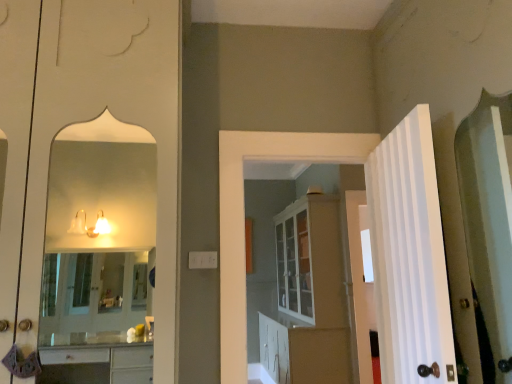
Question: Is white glossy cabinet at center not close to white striped door at right, which appears as the 2th door when viewed from the right?

Choices:
 (A) no
 (B) yes

Answer: (B)

Question: Does white glossy cabinet at center come behind white striped door at right, which appears as the 2th door when viewed from the right?

Choices:
 (A) yes
 (B) no

Answer: (A)

Question: Considering the relative sizes of white glossy cabinet at center and white striped door at right, which appears as the first door when viewed from the front, in the image provided, is white glossy cabinet at center smaller than white striped door at right, which appears as the first door when viewed from the front,?

Choices:
 (A) yes
 (B) no

Answer: (B)

Question: From a real-world perspective, is white glossy cabinet at center physically above white striped door at right, which appears as the first door when viewed from the front?

Choices:
 (A) no
 (B) yes

Answer: (A)

Question: Is white glossy cabinet at center in front of white striped door at right, which ranks as the third door in back-to-front order?

Choices:
 (A) yes
 (B) no

Answer: (B)

Question: Visually, is white glossy cabinet at center, positioned as the first door in left-to-right order, positioned to the left or to the right of white glossy door at right, which is the 1th door in back-to-front order?

Choices:
 (A) right
 (B) left

Answer: (B)

Question: Is point (237, 200) positioned closer to the camera than point (346, 205)?

Choices:
 (A) closer
 (B) farther

Answer: (A)

Question: Is white glossy cabinet at center, positioned as the first door in left-to-right order, bigger or smaller than white glossy door at right, which is the 1th door in back-to-front order?

Choices:
 (A) small
 (B) big

Answer: (B)

Question: From the image's perspective, is white glossy cabinet at center, the third door positioned from the right, located above or below white glossy door at right, the third door in the front-to-back sequence?

Choices:
 (A) below
 (B) above

Answer: (B)

Question: Considering the positions of white striped door at right, which appears as the first door when viewed from the front, and white glossy door at right, which is counted as the 3th door, starting from the left, in the image, is white striped door at right, which appears as the first door when viewed from the front, bigger or smaller than white glossy door at right, which is counted as the 3th door, starting from the left,?

Choices:
 (A) small
 (B) big

Answer: (B)

Question: From the image's perspective, is white striped door at right, which ranks as the third door in back-to-front order, above or below white glossy door at right, the third door in the front-to-back sequence?

Choices:
 (A) above
 (B) below

Answer: (A)

Question: Does point (441, 286) appear closer or farther from the camera than point (355, 208)?

Choices:
 (A) closer
 (B) farther

Answer: (A)

Question: Is white striped door at right, which ranks as the third door in back-to-front order, taller or shorter than white glossy door at right, which is counted as the 3th door, starting from the left?

Choices:
 (A) tall
 (B) short

Answer: (B)

Question: Visually, is white striped door at right, which appears as the 2th door when viewed from the right, positioned to the left or to the right of white glossy cabinet at center?

Choices:
 (A) right
 (B) left

Answer: (A)

Question: Considering the positions of white striped door at right, placed as the second door when sorted from left to right, and white glossy cabinet at center in the image, is white striped door at right, placed as the second door when sorted from left to right, wider or thinner than white glossy cabinet at center?

Choices:
 (A) wide
 (B) thin

Answer: (B)